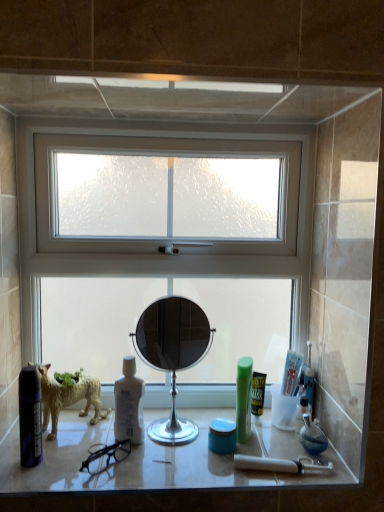
Where is `vacant point to the right of silver/metallic mirror at center`? vacant point to the right of silver/metallic mirror at center is located at coordinates [x=254, y=444].